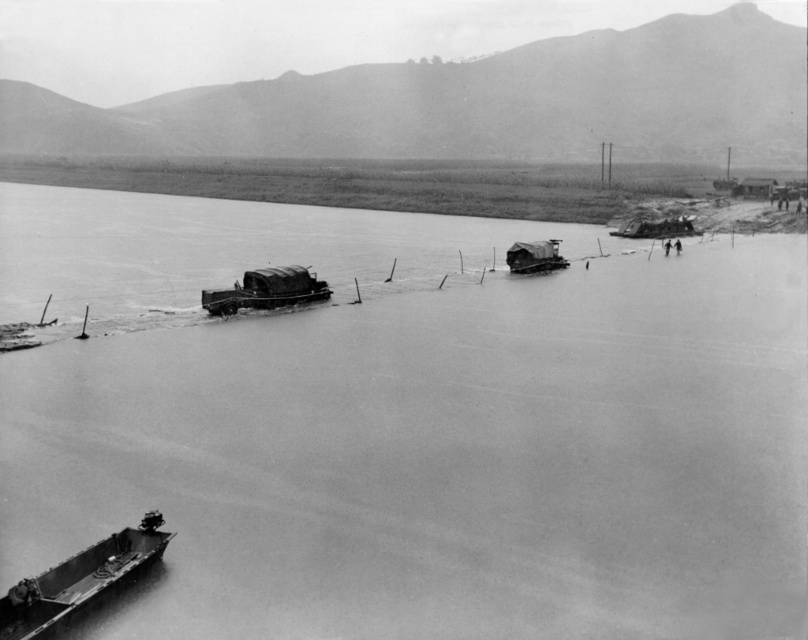
You are a photographer planning to capture the metallic gray boat at right and the smooth water at center in a single frame. Based on their sizes, which object should you focus on first to ensure both fit well in the composition?

The smooth water at center is larger in size than the metallic gray boat at right, so focusing on the smooth water at center first will help ensure both fit well in the composition.

In the scene shown: You are standing on the riverbank and see two points marked in the image. Which point, point (250, 269) or point (615, 230), is closer to you?

Point (250, 269) is closer to the viewer than point (615, 230).

You are a passenger on the metallic gray boat at center and want to board the wooden planks boat at center. Is there a direct path between them?

The metallic gray boat at center is positioned under the wooden planks boat at center, so there is a direct path between them as they are connected by poles or beams.